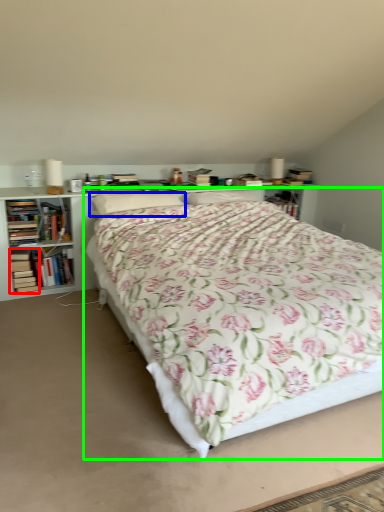
Question: Which object is positioned farthest from book (highlighted by a red box)? Select from pillow (highlighted by a blue box) and bed (highlighted by a green box).

Choices:
 (A) pillow
 (B) bed

Answer: (B)